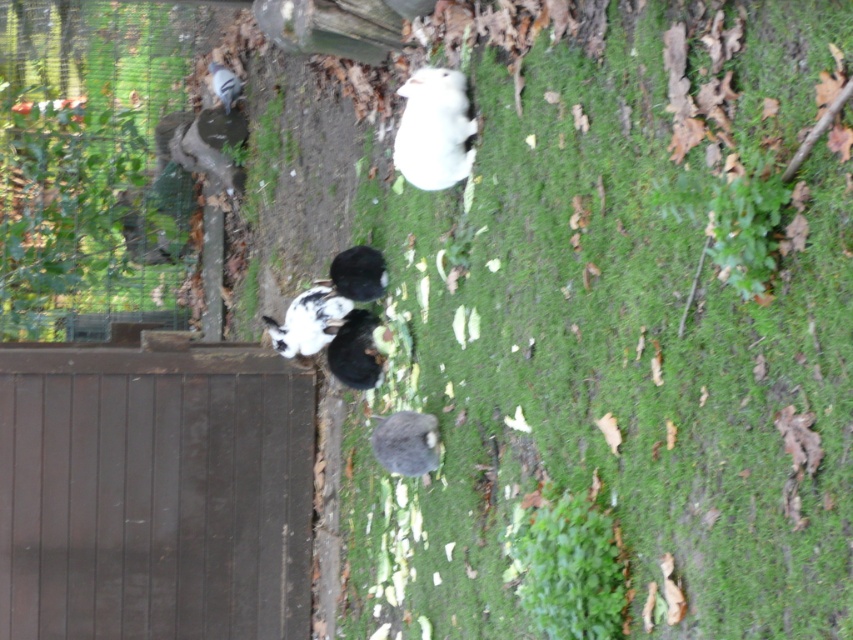
Question: Estimate the real-world distances between objects in this image. Which object is farther from the white fur rabbit at upper left?

Choices:
 (A) fluffy black and white rabbit at center
 (B) brown wooden gate at lower left
 (C) gray furry rabbit at center

Answer: (C)

Question: Among these points, which one is nearest to the camera?

Choices:
 (A) (144, 440)
 (B) (357, 374)
 (C) (444, 106)
 (D) (323, 316)

Answer: (C)

Question: Is fluffy black rabbit at center to the right of white fur rabbit at upper left from the viewer's perspective?

Choices:
 (A) no
 (B) yes

Answer: (B)

Question: Which of the following is the closest to the observer?

Choices:
 (A) white fluffy rabbit at upper center
 (B) white fluffy rabbit at center
 (C) fluffy black rabbit at center
 (D) fluffy black and white rabbit at center

Answer: (A)

Question: Observing the image, what is the correct spatial positioning of white fluffy rabbit at center in reference to fluffy black rabbit at center?

Choices:
 (A) left
 (B) right

Answer: (A)

Question: Can you confirm if fluffy black and white rabbit at center is thinner than white fur rabbit at upper left?

Choices:
 (A) no
 (B) yes

Answer: (B)